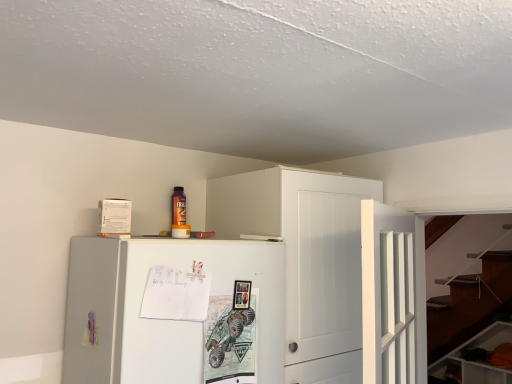
Question: Considering the relative positions of white matte cabinet at upper center, the 1th cabinetry in the left-to-right sequence, and white matte refrigerator at center in the image provided, is white matte cabinet at upper center, the 1th cabinetry in the left-to-right sequence, to the left of white matte refrigerator at center from the viewer's perspective?

Choices:
 (A) yes
 (B) no

Answer: (B)

Question: From the image's perspective, would you say white matte cabinet at upper center, the 1th cabinetry positioned from the front, is shown under white matte refrigerator at center?

Choices:
 (A) yes
 (B) no

Answer: (B)

Question: Can you confirm if white matte cabinet at upper center, the 1th cabinetry positioned from the front, is wider than white matte refrigerator at center?

Choices:
 (A) yes
 (B) no

Answer: (B)

Question: Is white matte cabinet at upper center, which is counted as the 2th cabinetry, starting from the bottom, looking in the opposite direction of white matte refrigerator at center?

Choices:
 (A) yes
 (B) no

Answer: (B)

Question: Is white matte cabinet at upper center, marked as the 2th cabinetry in a back-to-front arrangement, bigger than white matte refrigerator at center?

Choices:
 (A) yes
 (B) no

Answer: (A)

Question: From the image's perspective, is white glossy cabinet at lower right, the second cabinetry from the front, above or below white matte cabinet at upper center, the 1th cabinetry positioned from the front?

Choices:
 (A) below
 (B) above

Answer: (A)

Question: Considering the positions of point (510, 342) and point (306, 226), is point (510, 342) closer or farther from the camera than point (306, 226)?

Choices:
 (A) farther
 (B) closer

Answer: (A)

Question: Is white glossy cabinet at lower right, marked as the first cabinetry in a bottom-to-top arrangement, in front of or behind white matte cabinet at upper center, the 1th cabinetry positioned from the front, in the image?

Choices:
 (A) front
 (B) behind

Answer: (B)

Question: In terms of width, does white glossy cabinet at lower right, the second cabinetry from the front, look wider or thinner when compared to white matte cabinet at upper center, the second cabinetry viewed from the right?

Choices:
 (A) wide
 (B) thin

Answer: (B)

Question: In the image, is white wooden door at center-right on the left side or the right side of white matte cabinet at upper center, the 1th cabinetry when ordered from top to bottom?

Choices:
 (A) left
 (B) right

Answer: (B)

Question: Considering the positions of white wooden door at center-right and white matte cabinet at upper center, the 1th cabinetry in the left-to-right sequence, in the image, is white wooden door at center-right taller or shorter than white matte cabinet at upper center, the 1th cabinetry in the left-to-right sequence,?

Choices:
 (A) short
 (B) tall

Answer: (A)

Question: From the image's perspective, relative to white matte cabinet at upper center, the 1th cabinetry in the left-to-right sequence, is white wooden door at center-right above or below?

Choices:
 (A) below
 (B) above

Answer: (B)

Question: Looking at their shapes, would you say white wooden door at center-right is wider or thinner than white matte cabinet at upper center, the second cabinetry viewed from the right?

Choices:
 (A) wide
 (B) thin

Answer: (B)

Question: Would you say white matte cabinet at upper center, the 1th cabinetry when ordered from top to bottom, is to the left or to the right of white glossy cabinet at lower right, marked as the first cabinetry in a bottom-to-top arrangement, in the picture?

Choices:
 (A) left
 (B) right

Answer: (A)

Question: Based on their sizes in the image, would you say white matte cabinet at upper center, which is counted as the 2th cabinetry, starting from the bottom, is bigger or smaller than white glossy cabinet at lower right, marked as the first cabinetry in a bottom-to-top arrangement?

Choices:
 (A) small
 (B) big

Answer: (B)